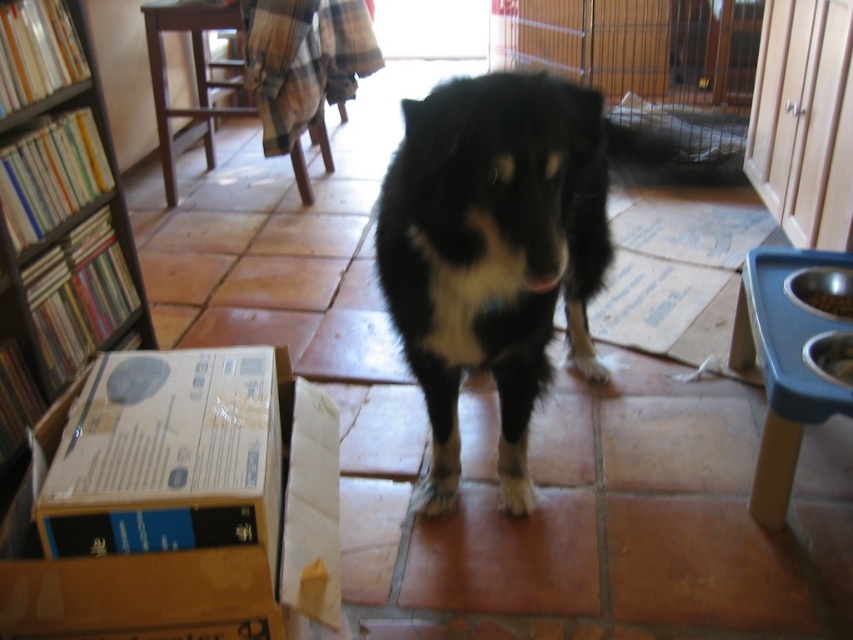
You are a delivery person who just arrived at this location. You need to place a large package that is 1.2 meters wide. The package must be placed either next to the black fur dog at center or the wooden bookshelf at left. Based on their sizes, which object can accommodate the package next to it without overcrowding the space?

The black fur dog at center is bigger than the wooden bookshelf at left, so the package should be placed next to the wooden bookshelf at left since it is smaller and might have more space available for the package.

You are moving into a new apartment and have a small wooden bookshelf at left and a wooden cage at center. Which object should you move first if you want to carry the lighter item?

The wooden bookshelf at left is smaller than wooden cage at center, so it is likely lighter and should be moved first.

You are a delivery person who needs to bring a new package into the room. The package is 1.2 meters wide. You see the black fur dog at center and the wooden bookshelf at left. Can the package fit through the space between them?

The black fur dog at center might be wider than wooden bookshelf at left, so the space between them may not be wide enough for the 1.2 meter wide package. Check the actual width before attempting to move the package through.